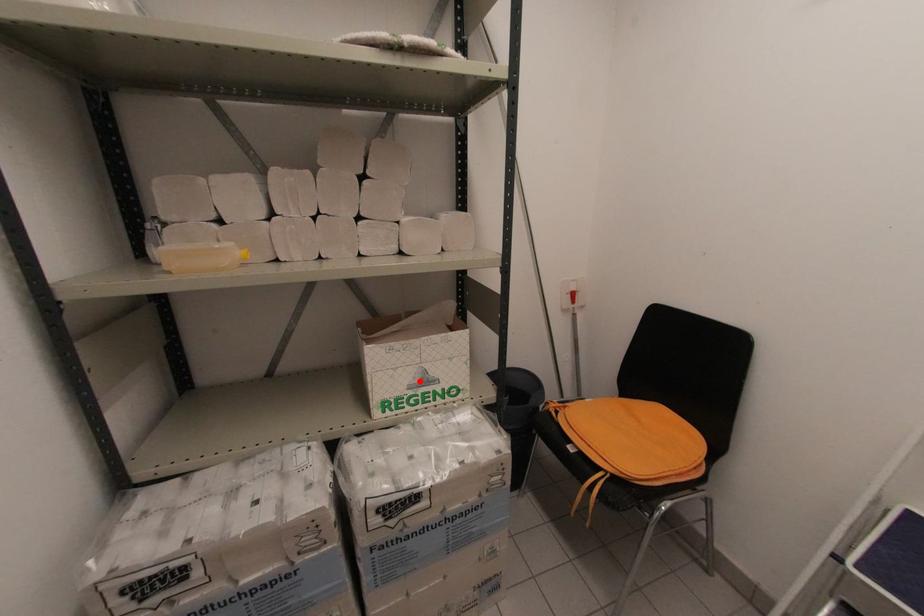
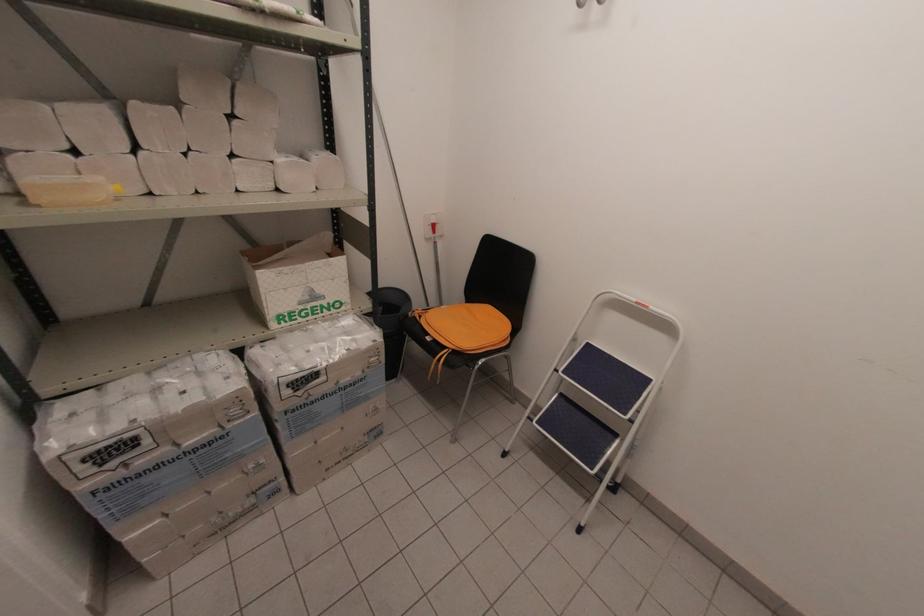
Question: A red point is marked in image1. In image2, is the corresponding 3D point closer to the camera or farther? Reply with the corresponding letter.

Choices:
 (A) The corresponding 3D point is closer.
 (B) The corresponding 3D point is farther.

Answer: (A)